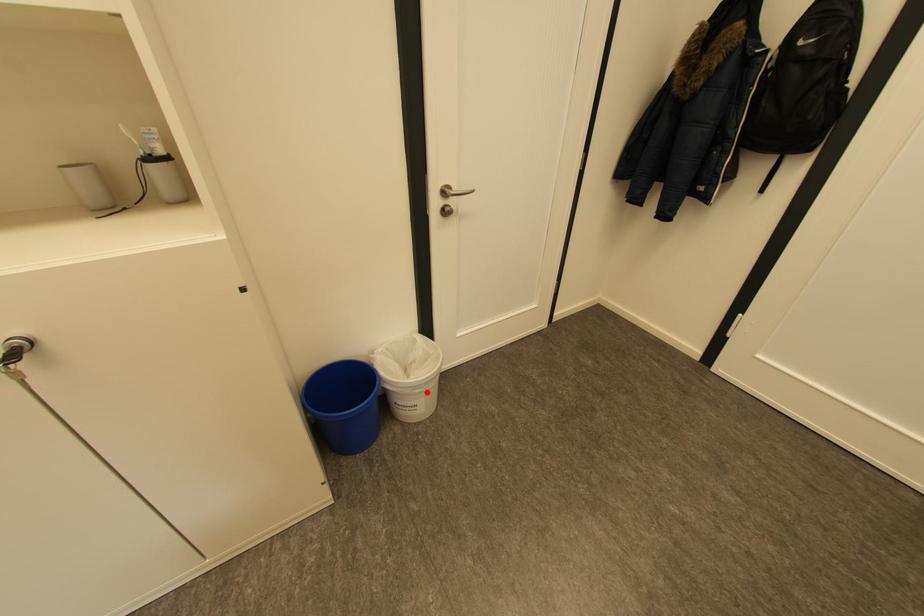
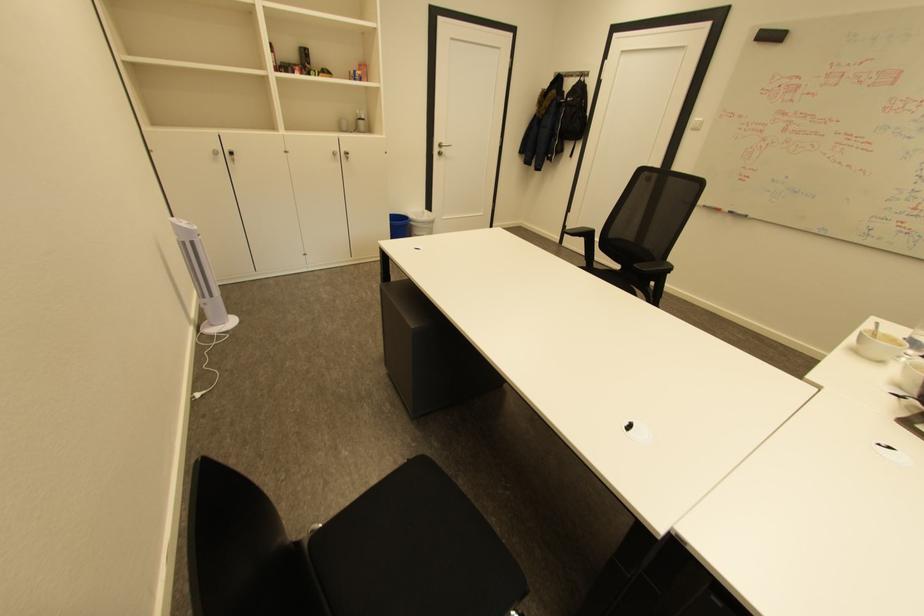
Where in the second image is the point corresponding to the highlighted location from the first image?

(432, 227)